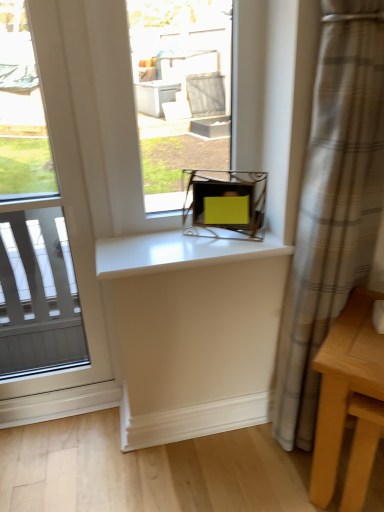
Question: Does point (243, 244) appear closer or farther from the camera than point (342, 7)?

Choices:
 (A) farther
 (B) closer

Answer: (A)

Question: Considering the positions of white glossy counter top at center and plaid fabric curtain at right in the image, is white glossy counter top at center wider or thinner than plaid fabric curtain at right?

Choices:
 (A) wide
 (B) thin

Answer: (A)

Question: Estimate the real-world distances between objects in this image. Which object is farther from the white glossy counter top at center?

Choices:
 (A) light wood table at lower right
 (B) plaid fabric curtain at right
 (C) clear glass window at left, which appears as the second window when viewed from the right
 (D) yellow matte box at center
 (E) matte yellow box at center, which is the 2th window from left to right

Answer: (E)

Question: Which object is the closest to the light wood table at lower right?

Choices:
 (A) yellow matte box at center
 (B) plaid fabric curtain at right
 (C) white glossy counter top at center
 (D) matte yellow box at center, which is the 1th window from right to left
 (E) clear glass window at left, positioned as the 1th window in left-to-right order

Answer: (B)